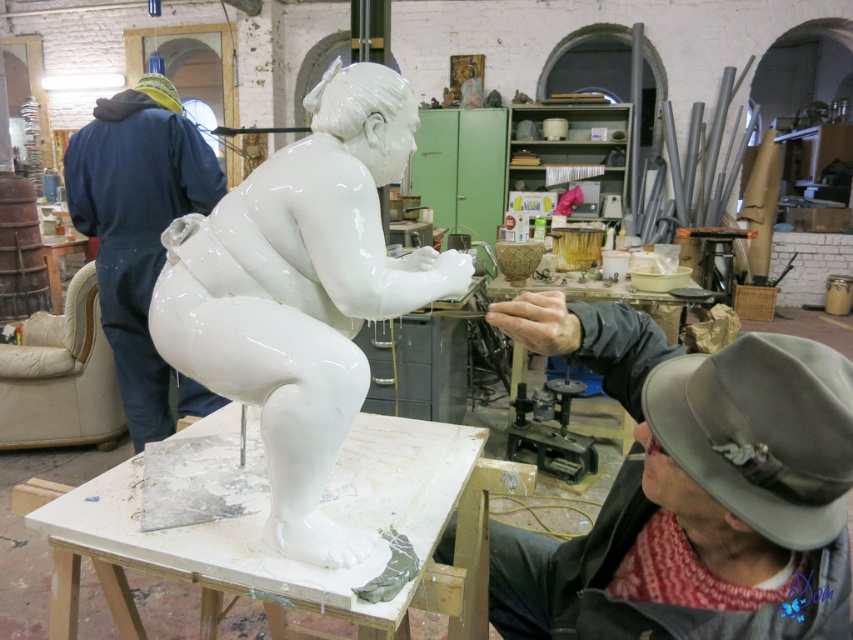
Question: Can you confirm if white glossy statue at center is wider than gray felt fedora at lower right?

Choices:
 (A) yes
 (B) no

Answer: (A)

Question: Can you confirm if white glossy statue at center is smaller than blue denim jumpsuit at left?

Choices:
 (A) yes
 (B) no

Answer: (A)

Question: Which object is positioned farthest from the blue denim jumpsuit at left?

Choices:
 (A) white glossy statue at center
 (B) gray felt fedora at lower right

Answer: (B)

Question: Which object is closer to the camera taking this photo?

Choices:
 (A) blue denim jumpsuit at left
 (B) gray felt fedora at lower right
 (C) white glossy statue at center

Answer: (B)

Question: Which object is farther from the camera taking this photo?

Choices:
 (A) blue denim jumpsuit at left
 (B) gray felt fedora at lower right
 (C) white glossy statue at center

Answer: (A)

Question: In this image, where is white glossy statue at center located relative to gray felt fedora at lower right?

Choices:
 (A) above
 (B) below

Answer: (A)